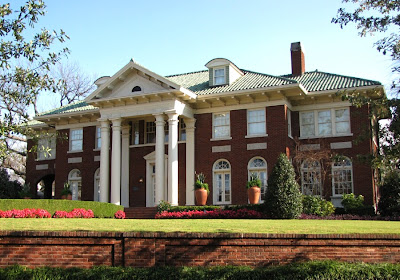
The height and width of the screenshot is (280, 400). Find the location of `4 windows on right side first floor`. 4 windows on right side first floor is located at coordinates (228, 179), (257, 172), (307, 179), (340, 182).